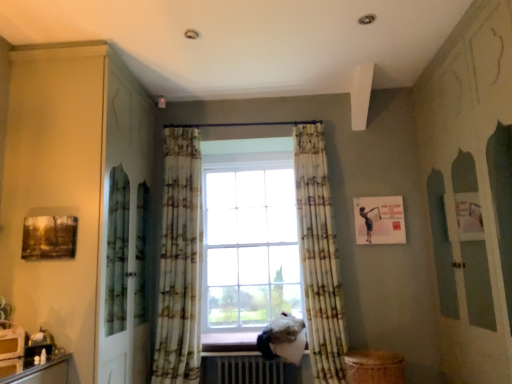
Question: From the image's perspective, is metallic silver radiator at lower center under floral fabric curtain at center, arranged as the second curtain when viewed from the left?

Choices:
 (A) yes
 (B) no

Answer: (A)

Question: Is metallic silver radiator at lower center positioned in front of floral fabric curtain at center, the first curtain from the right?

Choices:
 (A) no
 (B) yes

Answer: (A)

Question: Is there a large distance between metallic silver radiator at lower center and floral fabric curtain at center, arranged as the second curtain when viewed from the left?

Choices:
 (A) no
 (B) yes

Answer: (A)

Question: Considering the relative sizes of metallic silver radiator at lower center and floral fabric curtain at center, the first curtain from the right, in the image provided, is metallic silver radiator at lower center thinner than floral fabric curtain at center, the first curtain from the right,?

Choices:
 (A) no
 (B) yes

Answer: (A)

Question: Is metallic silver radiator at lower center beside floral fabric curtain at center, arranged as the second curtain when viewed from the left?

Choices:
 (A) no
 (B) yes

Answer: (A)

Question: Is floral fabric curtain at center, the first curtain from the right, in front of or behind floral fabric curtain at center, acting as the second curtain starting from the right, in the image?

Choices:
 (A) front
 (B) behind

Answer: (A)

Question: From a real-world perspective, relative to floral fabric curtain at center, the first curtain when ordered from left to right, is floral fabric curtain at center, the first curtain from the right, vertically above or below?

Choices:
 (A) above
 (B) below

Answer: (B)

Question: Is floral fabric curtain at center, the first curtain from the right, to the left or to the right of floral fabric curtain at center, the first curtain when ordered from left to right, in the image?

Choices:
 (A) right
 (B) left

Answer: (A)

Question: In terms of size, does floral fabric curtain at center, arranged as the second curtain when viewed from the left, appear bigger or smaller than floral fabric curtain at center, acting as the second curtain starting from the right?

Choices:
 (A) small
 (B) big

Answer: (A)

Question: From a real-world perspective, is floral fabric curtain at center, the first curtain when ordered from left to right, physically located above or below metallic silver radiator at lower center?

Choices:
 (A) above
 (B) below

Answer: (A)

Question: Looking at their shapes, would you say floral fabric curtain at center, the first curtain when ordered from left to right, is wider or thinner than metallic silver radiator at lower center?

Choices:
 (A) thin
 (B) wide

Answer: (A)

Question: Is floral fabric curtain at center, acting as the second curtain starting from the right, bigger or smaller than metallic silver radiator at lower center?

Choices:
 (A) small
 (B) big

Answer: (B)

Question: Would you say floral fabric curtain at center, the first curtain when ordered from left to right, is to the left or to the right of metallic silver radiator at lower center in the picture?

Choices:
 (A) right
 (B) left

Answer: (B)

Question: From a real-world perspective, is wooden at lower center physically located above or below metallic silver radiator at lower center?

Choices:
 (A) above
 (B) below

Answer: (A)

Question: Is wooden at lower center spatially inside metallic silver radiator at lower center, or outside of it?

Choices:
 (A) outside
 (B) inside

Answer: (A)